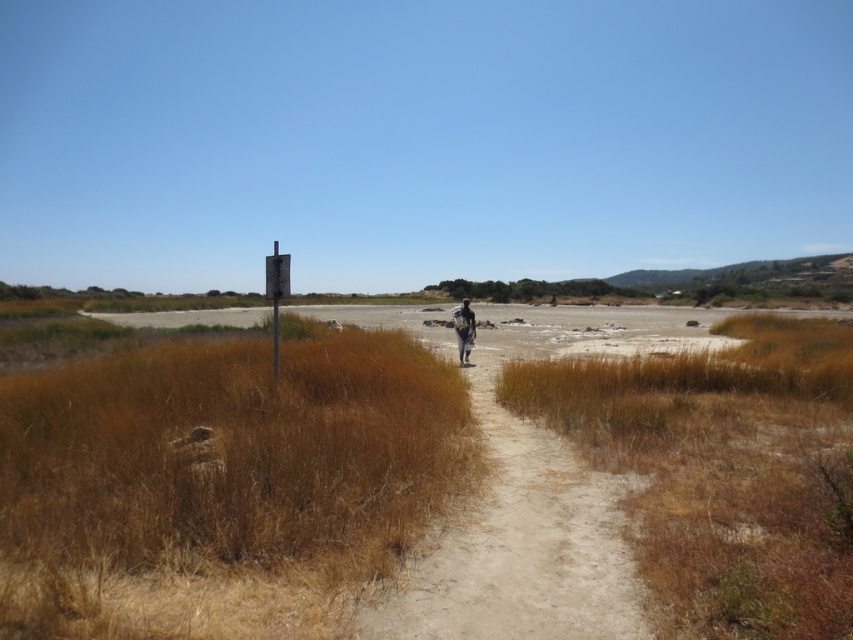
Between point (223, 630) and point (467, 323), which one is positioned in front?

Point (223, 630)

Does point (437, 406) come farther from viewer compared to point (459, 340)?

No.

Describe the element at coordinates (219, 484) in the screenshot. This screenshot has height=640, width=853. I see `brown dry grass at lower left` at that location.

I want to click on brown dry grass at lower left, so click(219, 484).